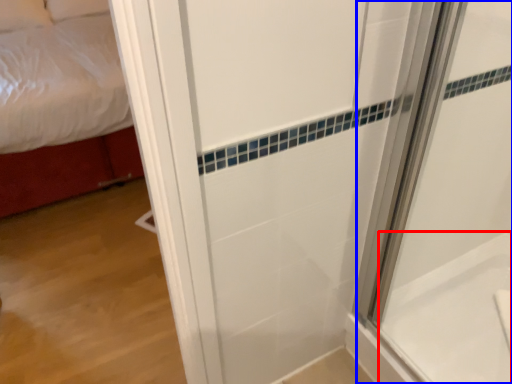
Question: Which object appears farthest to the camera in this image, bath (highlighted by a red box) or shower door (highlighted by a blue box)?

Choices:
 (A) bath
 (B) shower door

Answer: (A)